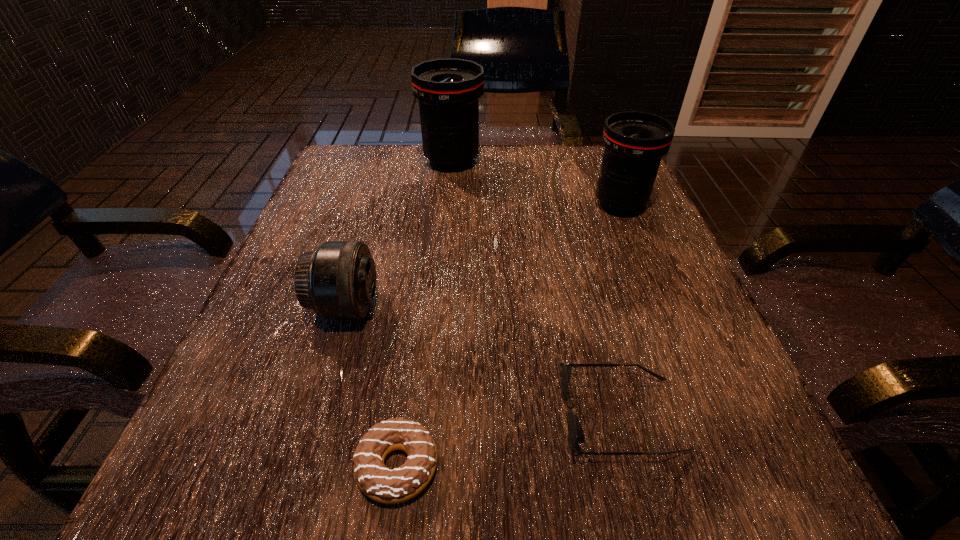
You are a GUI agent. You are given a task and a screenshot of the screen. Output one action in this format:
    pyautogui.click(x=<x>, y=<y>)
    Task: Click on the object at the far right corner
    The height and width of the screenshot is (540, 960).
    Given the screenshot: What is the action you would take?
    pyautogui.click(x=634, y=142)

The image size is (960, 540). I want to click on object at the near right corner, so click(576, 435).

In order to click on free space at the far edge in this screenshot , I will do `click(425, 158)`.

Locate an element on the screen. vacant point at the near edge is located at coordinates (633, 470).

Where is `free region at the left edge of the desktop`? free region at the left edge of the desktop is located at coordinates coord(253,353).

Where is `vacant space at the right edge of the desktop`? The width and height of the screenshot is (960, 540). vacant space at the right edge of the desktop is located at coordinates (673, 372).

Image resolution: width=960 pixels, height=540 pixels. In order to click on free space at the far right corner in this screenshot , I will do `click(602, 156)`.

This screenshot has width=960, height=540. Find the location of `vacant area that lies between the nearest telephoto lens and the farthest telephoto lens`. vacant area that lies between the nearest telephoto lens and the farthest telephoto lens is located at coordinates (399, 234).

You are a GUI agent. You are given a task and a screenshot of the screen. Output one action in this format:
    pyautogui.click(x=<x>, y=<y>)
    Task: Click on the unoccupied position between the second shortest telephoto lens and the leftmost telephoto lens
    This screenshot has width=960, height=540.
    Given the screenshot: What is the action you would take?
    pyautogui.click(x=483, y=256)

This screenshot has height=540, width=960. I want to click on free space that is in between the rightmost telephoto lens and the tallest object, so click(x=536, y=183).